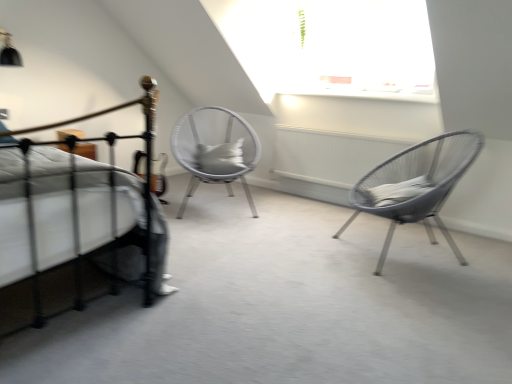
This screenshot has height=384, width=512. What are the coordinates of `vacant space in between metallic wire chair at right, which is counted as the second chair, starting from the left, and black metal bed at left` in the screenshot? It's located at (257, 266).